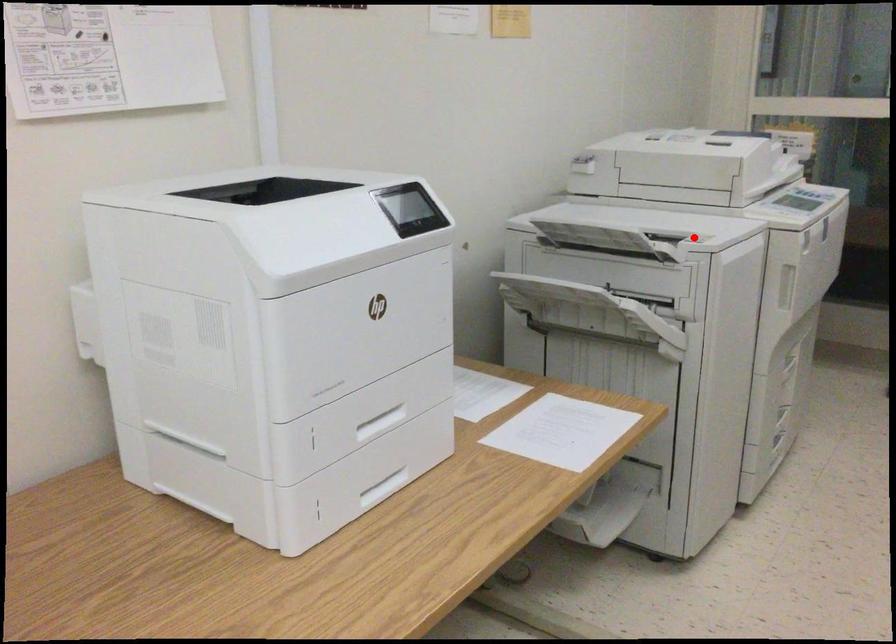
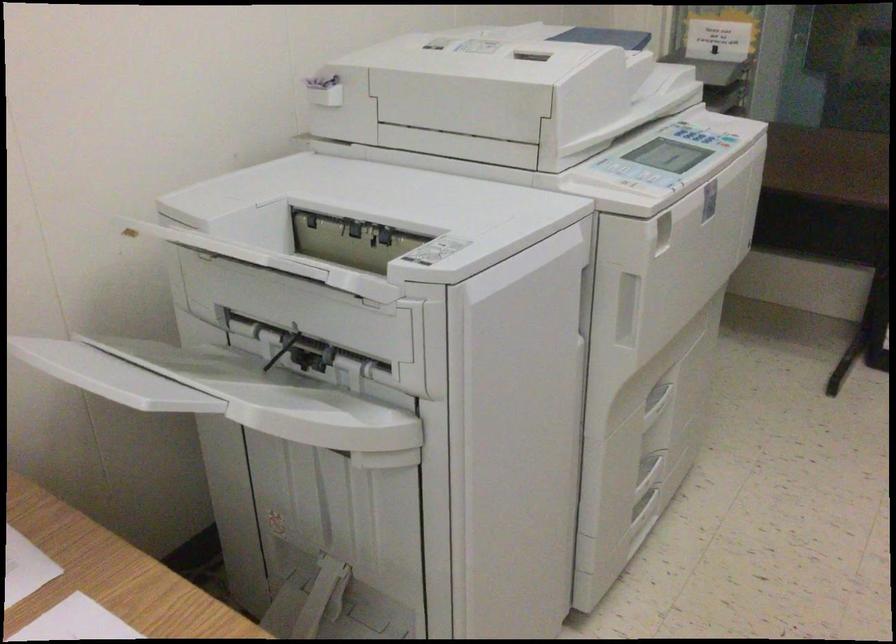
Find the pixel in the second image that matches the highlighted location in the first image.

(435, 251)